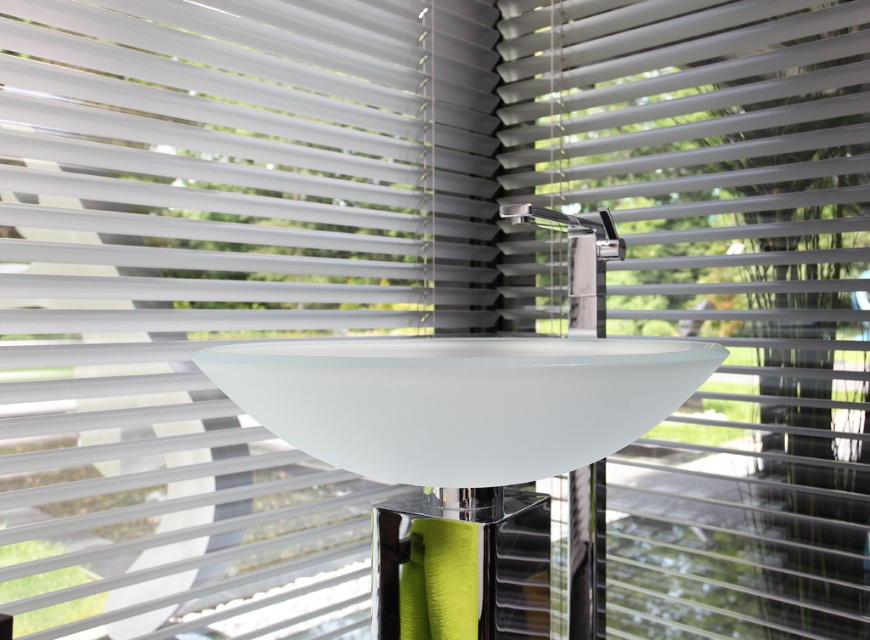
You are designing a bathroom layout and want to ensure the white matte blind at center and the polished chrome faucet at center are visible from the entrance. Given their sizes, which object will appear bigger in the bathroom?

The white matte blind at center has a larger size compared to the polished chrome faucet at center, so it will appear bigger in the bathroom.

You are designing a layout for a bathroom and need to place a decorative plant. The plant needs to be placed to the right of the frosted glass sink at center and to the left of the polished chrome faucet at center. Is this possible?

The frosted glass sink at center is positioned on the left side of polished chrome faucet at center, so placing the plant to the right of the frosted glass sink at center and to the left of the polished chrome faucet at center is possible between them.

You are a maintenance worker who needs to clean the white matte blind at center and the frosted glass sink at center. If you have a 10 inch long cleaning tool, can you reach both objects from your current position without moving?

The distance between the white matte blind at center and the frosted glass sink at center is 9.49 inches, so yes, the tool can reach both objects as the distance is within the tool length.